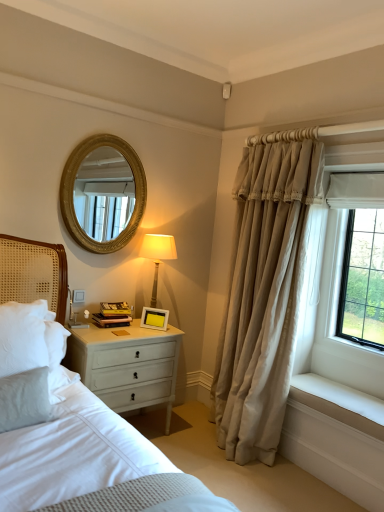
This screenshot has height=512, width=384. Find the location of `free space to the right of hardcover books at bedside`. free space to the right of hardcover books at bedside is located at coordinates (141, 328).